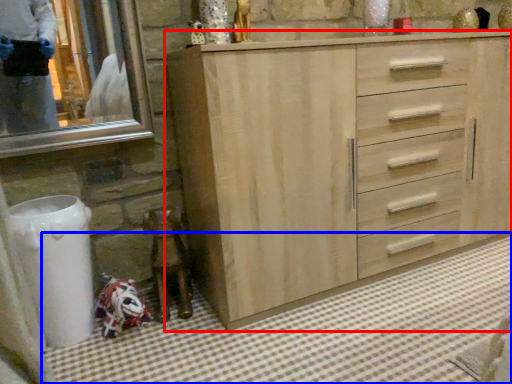
Question: Which object is closer to the camera taking this photo, chest of drawers (highlighted by a red box) or bath mat (highlighted by a blue box)?

Choices:
 (A) chest of drawers
 (B) bath mat

Answer: (B)